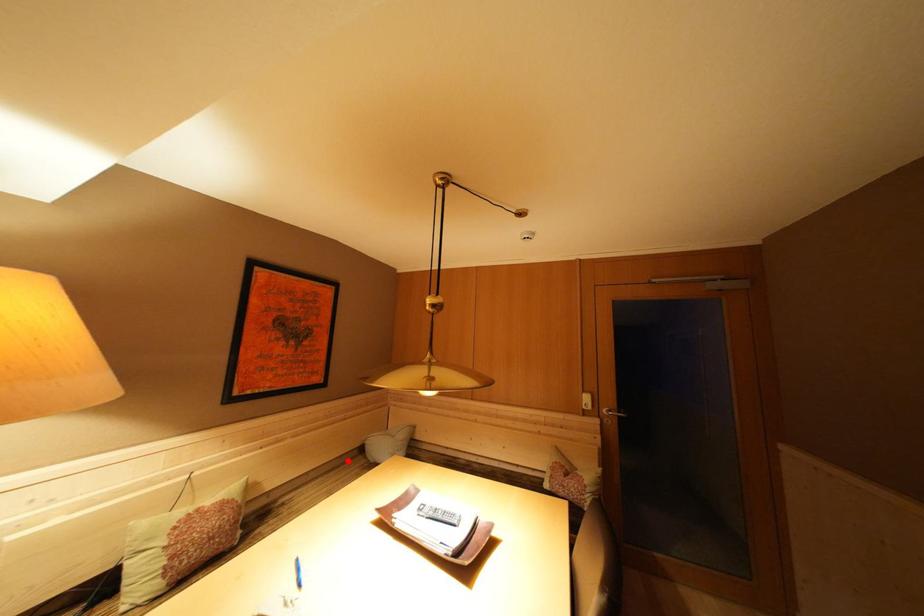
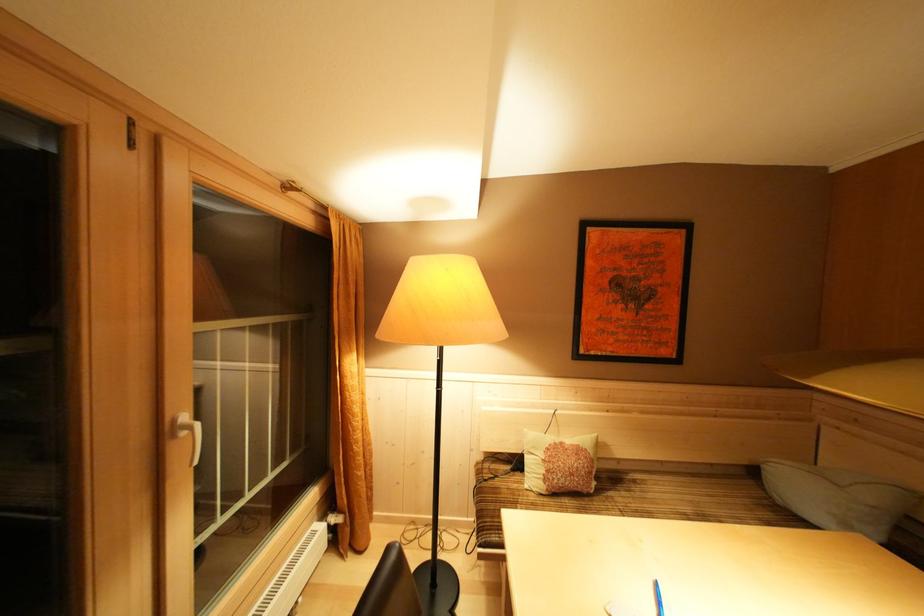
Locate, in the second image, the point that corresponds to the highlighted location in the first image.

(718, 468)